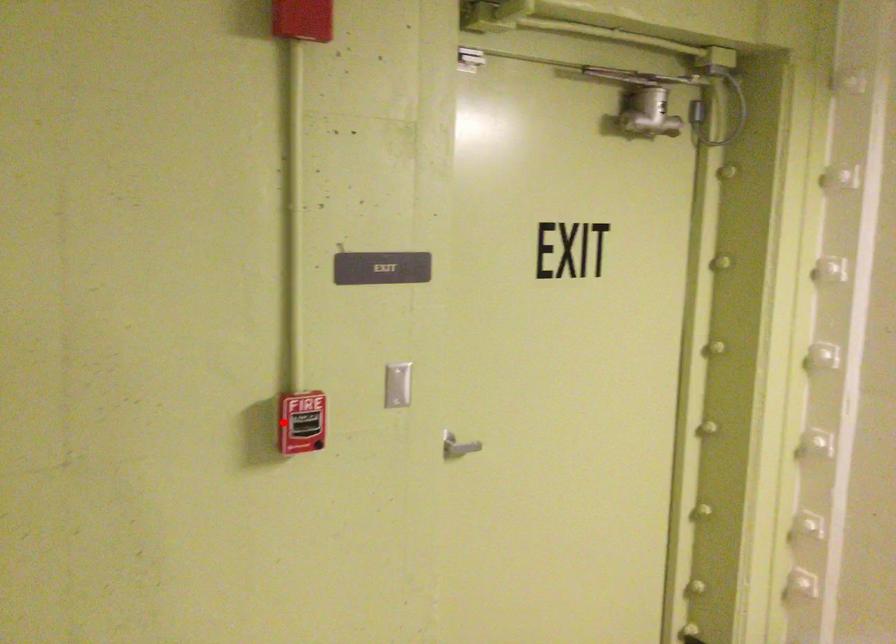
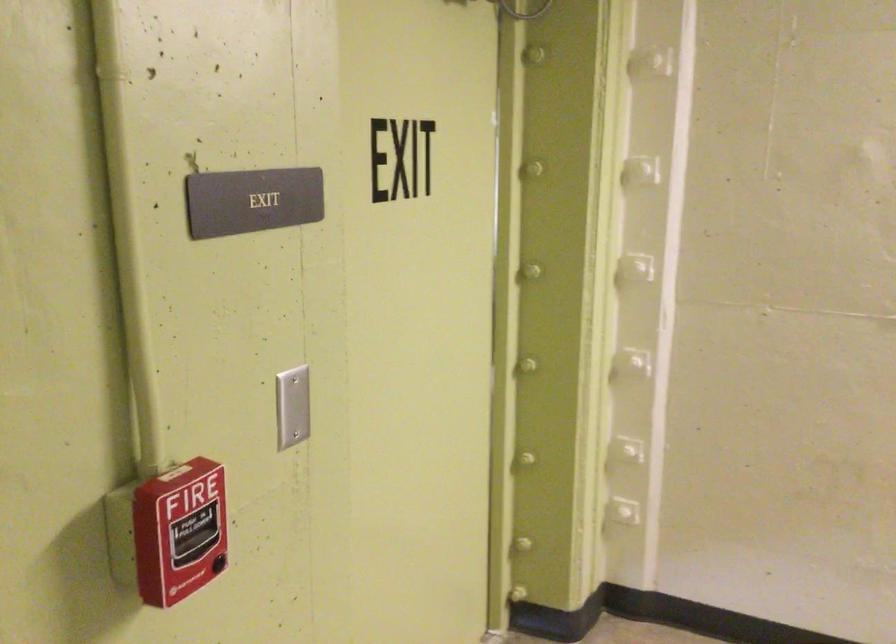
Question: I am providing you with two images of the same scene from different viewpoints. Given a red point in image1, look at the same physical point in image2. Is it:

Choices:
 (A) Closer to the viewpoint
 (B) Farther from the viewpoint

Answer: (A)